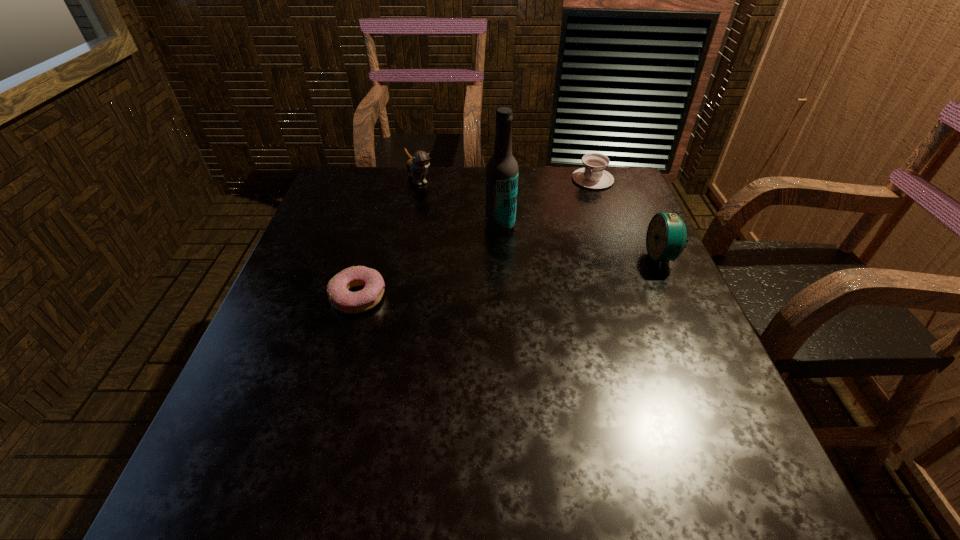
Locate an element on the screen. vacant region located on the front-facing side of the alarm clock is located at coordinates (484, 257).

At what (x,y) coordinates should I click in order to perform the action: click on vacant space positioned on the front-facing side of the alarm clock. Please return your answer as a coordinate pair (x, y). This screenshot has width=960, height=540. Looking at the image, I should click on (602, 257).

Identify the location of free point located 0.260m on the front-facing side of the alarm clock. (540, 257).

Image resolution: width=960 pixels, height=540 pixels. I want to click on free spot located 0.060m on the side of the third nearest object with the label, so click(x=489, y=249).

Locate an element on the screen. vacant area situated on the side of the third nearest object with the label is located at coordinates (449, 327).

Identify the location of free space located on the side of the third nearest object with the label. This screenshot has width=960, height=540. (446, 334).

Identify the location of vacant space located 0.070m on the front-facing side of the kitten. The height and width of the screenshot is (540, 960). (435, 202).

Locate an element on the screen. The image size is (960, 540). vacant space located on the front-facing side of the kitten is located at coordinates (477, 251).

You are a GUI agent. You are given a task and a screenshot of the screen. Output one action in this format:
    pyautogui.click(x=<x>, y=<y>)
    Task: Click on the vacant space located 0.280m on the front-facing side of the kitten
    The image size is (960, 540).
    Given the screenshot: What is the action you would take?
    pyautogui.click(x=469, y=242)

Where is `vacant space located 0.140m on the handle side of the teacup`? vacant space located 0.140m on the handle side of the teacup is located at coordinates (575, 214).